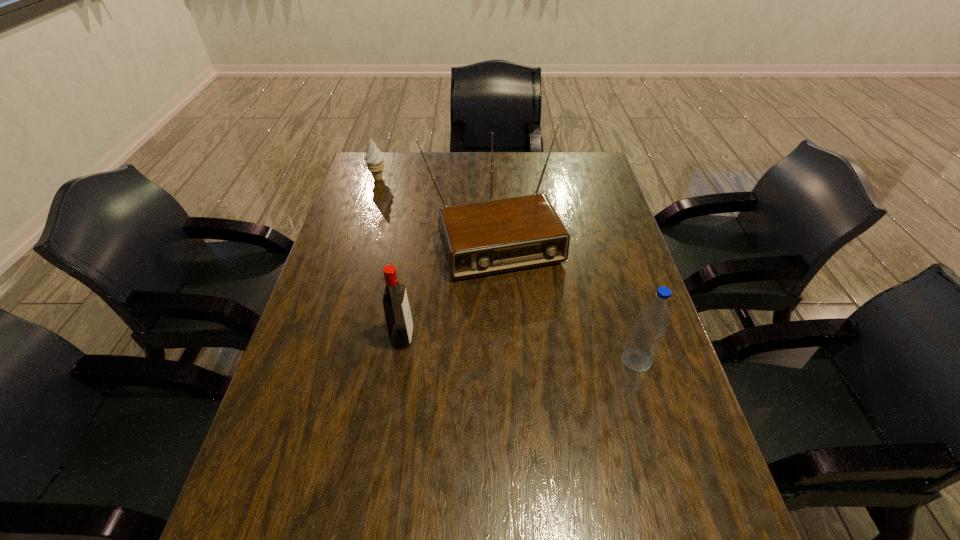
In order to click on free spot between the farthest object and the third nearest object in this screenshot , I will do `click(436, 207)`.

At what (x,y) coordinates should I click in order to perform the action: click on free spot between the radio_receiver and the icecream. Please return your answer as a coordinate pair (x, y). Looking at the image, I should click on (436, 207).

Select which object appears as the third closest to the vodka. Please provide its 2D coordinates. Your answer should be formatted as a tuple, i.e. [(x, y)], where the tuple contains the x and y coordinates of a point satisfying the conditions above.

[(374, 158)]

Find the location of a particular element. The image size is (960, 540). the closest object to the vodka is located at coordinates (494, 236).

Identify the location of free region that satisfies the following two spatial constraints: 1. on the front side of the icecream; 2. on the right side of the water bottle. (324, 360).